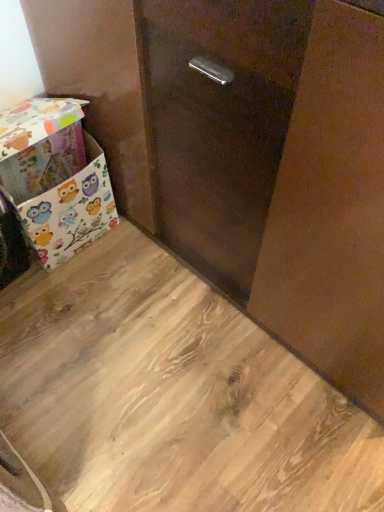
In order to face owl-patterned fabric box at lower left, should I rotate leftwards or rightwards?

Turn left by 20.982 degrees to look at owl-patterned fabric box at lower left.

What are the coordinates of `owl-patterned fabric box at lower left` in the screenshot? It's located at (55, 177).

Describe the element at coordinates (55, 177) in the screenshot. This screenshot has height=512, width=384. I see `owl-patterned fabric box at lower left` at that location.

This screenshot has height=512, width=384. Describe the element at coordinates (170, 395) in the screenshot. I see `wooden floor at lower left` at that location.

What is the approximate height of wooden floor at lower left?

wooden floor at lower left is 1.47 inches in height.

Identify the location of wooden floor at lower left. (170, 395).

I want to click on owl-patterned fabric box at lower left, so click(x=55, y=177).

Which is more to the left, owl-patterned fabric box at lower left or wooden floor at lower left?

owl-patterned fabric box at lower left.

Is owl-patterned fabric box at lower left behind wooden floor at lower left?

Yes, owl-patterned fabric box at lower left is further from the viewer.

Is point (11, 184) positioned in front of point (224, 314)?

Yes, point (11, 184) is closer to viewer.

From the image's perspective, who appears lower, owl-patterned fabric box at lower left or wooden floor at lower left?

wooden floor at lower left, from the image's perspective.

From a real-world perspective, is owl-patterned fabric box at lower left on top of wooden floor at lower left?

Yes, from a real-world perspective, owl-patterned fabric box at lower left is over wooden floor at lower left

Which of these two, owl-patterned fabric box at lower left or wooden floor at lower left, is thinner?

Thinner between the two is owl-patterned fabric box at lower left.

Who is shorter, owl-patterned fabric box at lower left or wooden floor at lower left?

Standing shorter between the two is wooden floor at lower left.

In the scene shown: Between owl-patterned fabric box at lower left and wooden floor at lower left, which one has larger size?

owl-patterned fabric box at lower left is bigger.

Is owl-patterned fabric box at lower left inside or outside of wooden floor at lower left?

owl-patterned fabric box at lower left lies outside wooden floor at lower left.

Are owl-patterned fabric box at lower left and wooden floor at lower left making contact?

They are not placed beside each other.

Is wooden floor at lower left at the back of owl-patterned fabric box at lower left?

No, owl-patterned fabric box at lower left's orientation is not away from wooden floor at lower left.

What's the angular difference between owl-patterned fabric box at lower left and wooden floor at lower left's facing directions?

0.154 degrees separate the facing orientations of owl-patterned fabric box at lower left and wooden floor at lower left.

This screenshot has width=384, height=512. Identify the location of box above the wooden floor at lower left (from a real-world perspective). (55, 177).

Which is more to the right, wooden floor at lower left or owl-patterned fabric box at lower left?

wooden floor at lower left is more to the right.

Relative to owl-patterned fabric box at lower left, is wooden floor at lower left in front or behind?

In the image, wooden floor at lower left appears in front of owl-patterned fabric box at lower left.

Does point (89, 416) appear closer or farther from the camera than point (29, 146)?

Point (89, 416) is farther from the camera than point (29, 146).

From the image's perspective, relative to owl-patterned fabric box at lower left, is wooden floor at lower left above or below?

wooden floor at lower left is below owl-patterned fabric box at lower left.

From a real-world perspective, is wooden floor at lower left positioned above or below owl-patterned fabric box at lower left?

From a real-world perspective, wooden floor at lower left is physically below owl-patterned fabric box at lower left.

In terms of width, does wooden floor at lower left look wider or thinner when compared to owl-patterned fabric box at lower left?

Clearly, wooden floor at lower left has more width compared to owl-patterned fabric box at lower left.

Is wooden floor at lower left shorter than owl-patterned fabric box at lower left?

Yes, wooden floor at lower left is shorter than owl-patterned fabric box at lower left.

In terms of size, does wooden floor at lower left appear bigger or smaller than owl-patterned fabric box at lower left?

wooden floor at lower left is smaller than owl-patterned fabric box at lower left.

Is wooden floor at lower left surrounding owl-patterned fabric box at lower left?

That's incorrect, owl-patterned fabric box at lower left is not inside wooden floor at lower left.

Is wooden floor at lower left positioned far away from owl-patterned fabric box at lower left?

wooden floor at lower left is actually quite close to owl-patterned fabric box at lower left.

Is wooden floor at lower left oriented towards owl-patterned fabric box at lower left?

No, wooden floor at lower left is not facing towards owl-patterned fabric box at lower left.

How many degrees apart are the facing directions of wooden floor at lower left and owl-patterned fabric box at lower left?

wooden floor at lower left and owl-patterned fabric box at lower left are facing 0.154 degrees away from each other.

How far apart are wooden floor at lower left and owl-patterned fabric box at lower left?

38.53 centimeters.

This screenshot has width=384, height=512. Identify the location of plywood below the owl-patterned fabric box at lower left (from the image's perspective). (170, 395).

Where is `box behind the wooden floor at lower left`? Image resolution: width=384 pixels, height=512 pixels. box behind the wooden floor at lower left is located at coordinates (55, 177).

This screenshot has height=512, width=384. Find the location of `plywood located underneath the owl-patterned fabric box at lower left (from a real-world perspective)`. plywood located underneath the owl-patterned fabric box at lower left (from a real-world perspective) is located at coordinates coord(170,395).